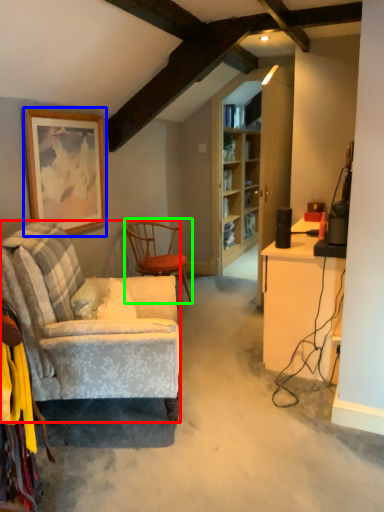
Question: Which object is positioned farthest from chair (highlighted by a red box)? Select from picture frame (highlighted by a blue box) and chair (highlighted by a green box).

Choices:
 (A) picture frame
 (B) chair

Answer: (B)